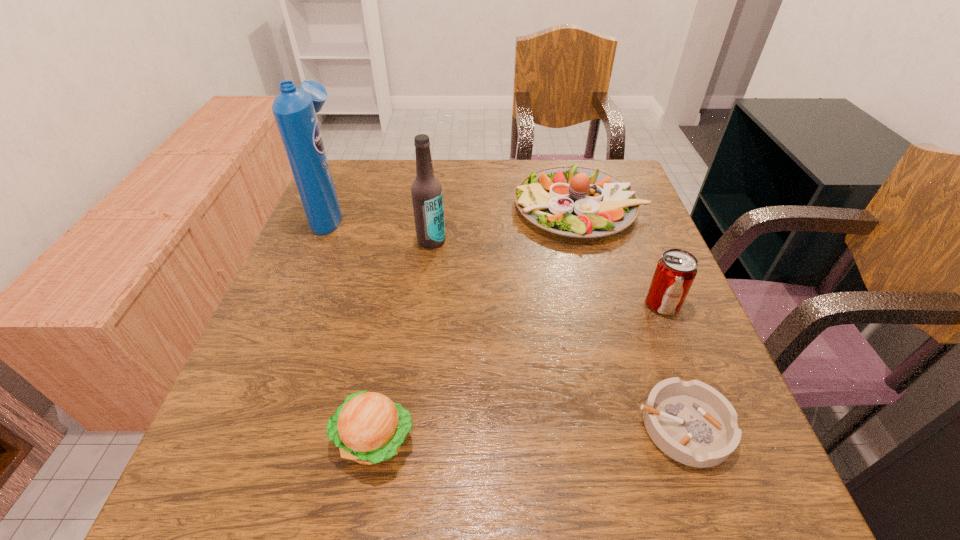
This screenshot has width=960, height=540. Find the location of `the third closest object to the fourth farthest object`. the third closest object to the fourth farthest object is located at coordinates (426, 190).

Choose which object is the fourth nearest neighbor to the fifth shortest object. Please provide its 2D coordinates. Your answer should be formatted as a tuple, i.e. [(x, y)], where the tuple contains the x and y coordinates of a point satisfying the conditions above.

[(675, 271)]

Where is `vacant space that satisfies the following two spatial constraints: 1. on the side of the fourth shortest object with the label; 2. on the right side of the beer bottle`? vacant space that satisfies the following two spatial constraints: 1. on the side of the fourth shortest object with the label; 2. on the right side of the beer bottle is located at coordinates (423, 303).

Identify the location of free point that satisfies the following two spatial constraints: 1. on the side of the beer bottle with the label; 2. on the right side of the fourth farthest object. (423, 303).